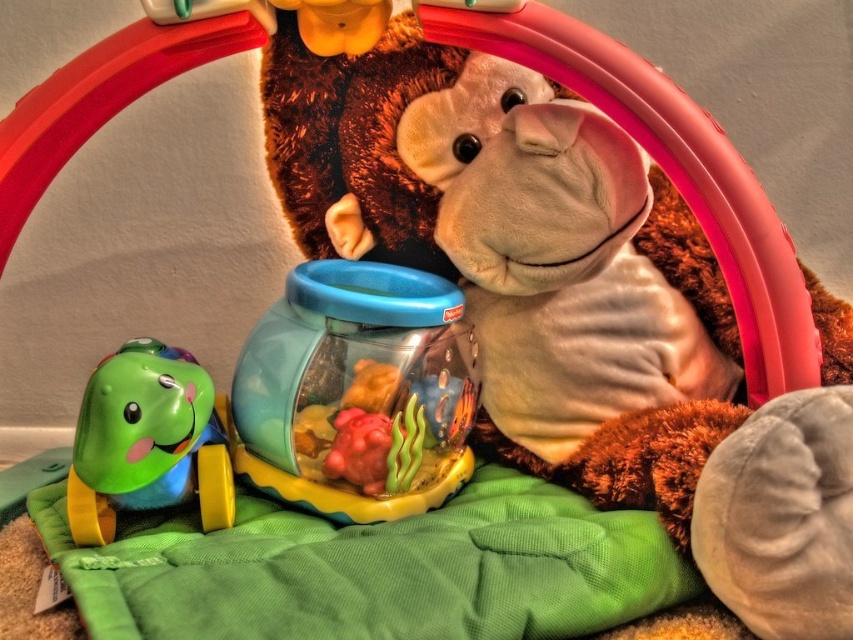
You are setting up a nursery and want to place a new toy on the shelf. The shelf has a space that is 0.5 meters wide. Can the fuzzy brown teddy bear at center fit in this space if it is currently positioned at point 0.486 meters from the left edge and 0.679 meters from the bottom edge?

The fuzzy brown teddy bear at center is located at point 0.486 meters from the left edge. Since the shelf space is 0.5 meters wide, the teddy bear can fit within the space as its position does not exceed the width limit.

You are a child who wants to place a new toy between the fuzzy brown teddy bear at center and the green rubber turtle at lower left. The toy is 30 centimeters long. Do you think it will fit between them?

The distance between the fuzzy brown teddy bear at center and the green rubber turtle at lower left is 29.53 centimeters. Since the toy is 30 centimeters long, it will not fit between them as the space is slightly smaller than the toy.